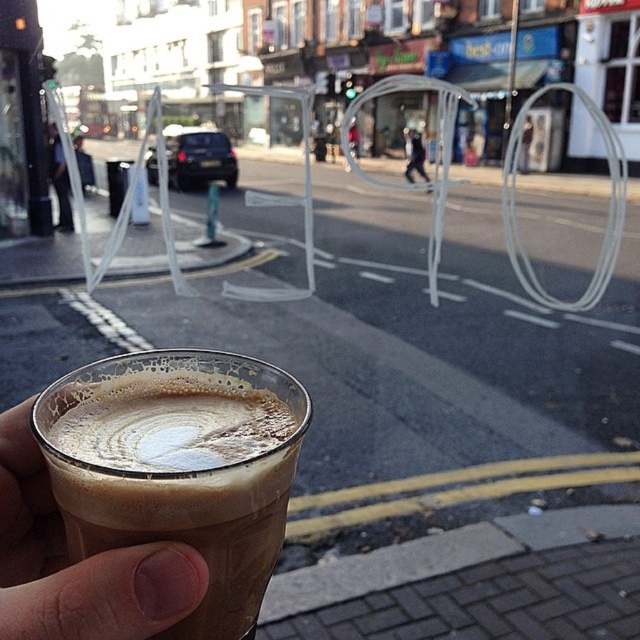
You are holding a phone and want to take a photo of the foamy brown latte at lower left and dark blue jeans at center in the scene. Can you fit both in the frame without zooming in?

The foamy brown latte at lower left and dark blue jeans at center are 8.34 inches apart. Since the distance between them is relatively small, you can likely fit both in the frame without zooming in.

You are holding a coffee cup and want to place it on a table that can only accommodate items narrower than the dark blue jeans at center. Can the foamy brown latte at lower left fit on the table?

The foamy brown latte at lower left has a width larger than the dark blue jeans at center. Since the table can only accommodate items narrower than the dark blue jeans at center, the foamy brown latte at lower left cannot fit on the table.

You are a barista trying to clean up a table. You see the foamy brown latte at lower left and dark blue jeans at left. Which object is closer to the right side of the table?

The foamy brown latte at lower left is to the right of dark blue jeans at left, so it is closer to the right side of the table.